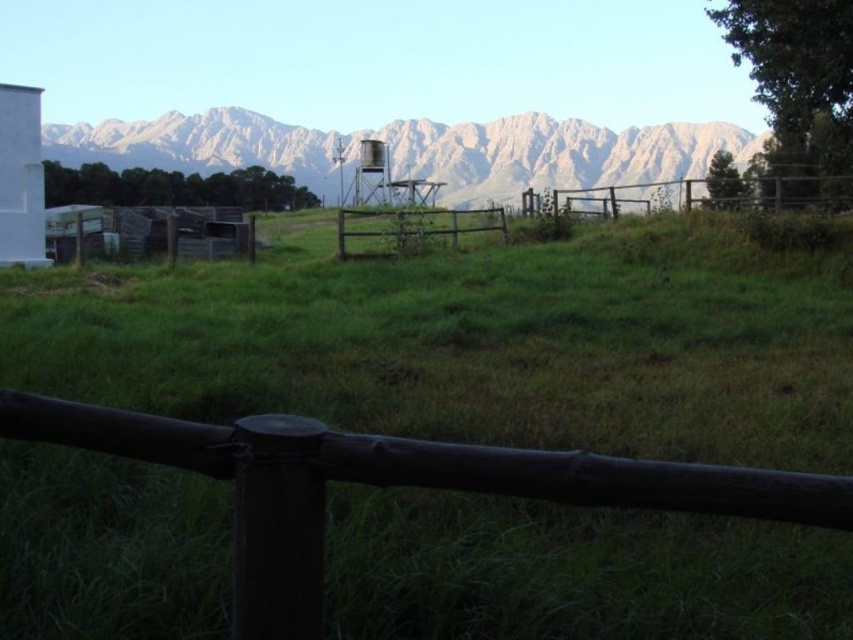
You are standing at the point with coordinates (389,484) in the rural landscape. What object is located exactly at this point?

The dark wood fence at center is located exactly at point (389,484).

You are standing at the point marked as point (389, 484) in the image. What object is directly under your feet?

The dark wood fence at center is directly under point (389, 484).